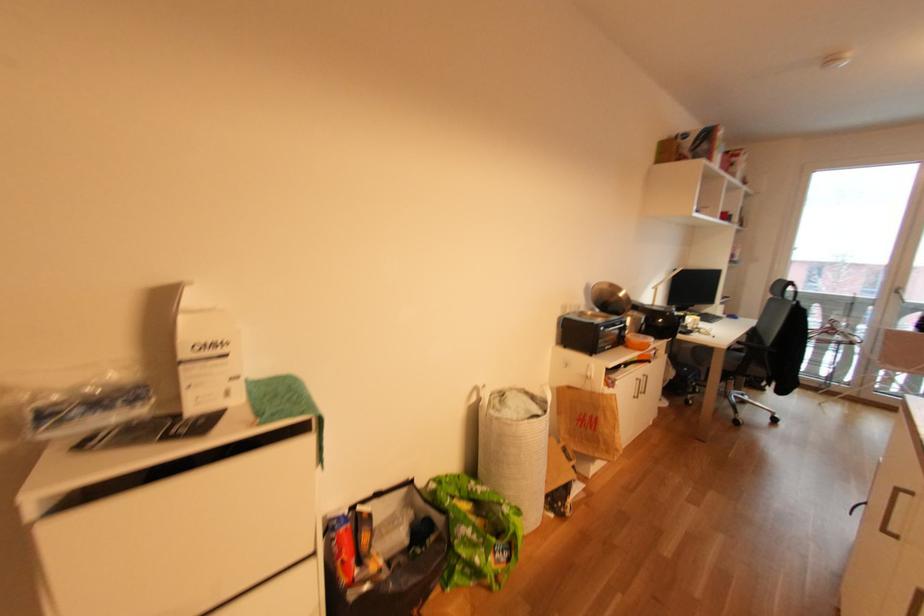
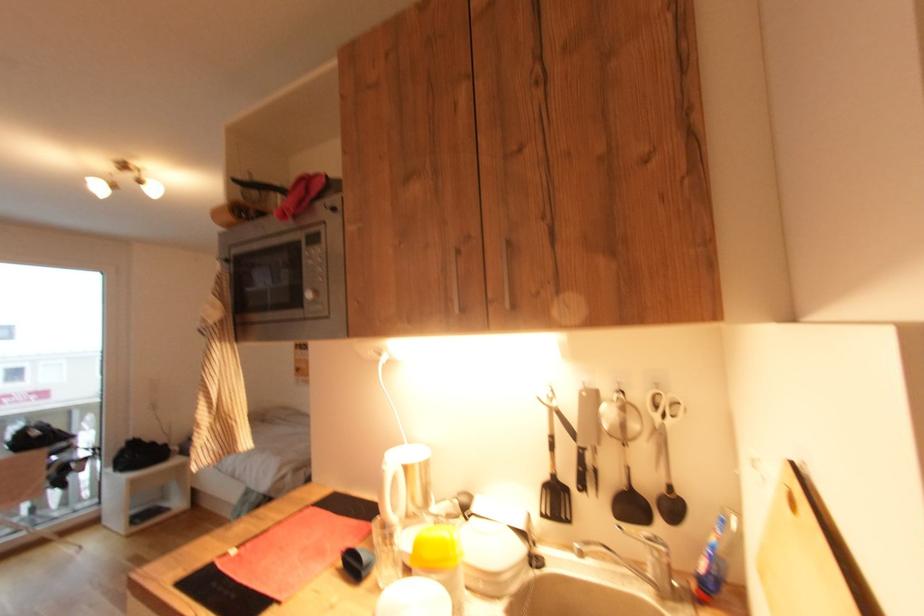
Question: The camera is either moving clockwise (left) or counter-clockwise (right) around the object. The first image is from the beginning of the video and the second image is from the end. Is the camera moving left or right when shooting the video?

Choices:
 (A) Left
 (B) Right

Answer: (A)